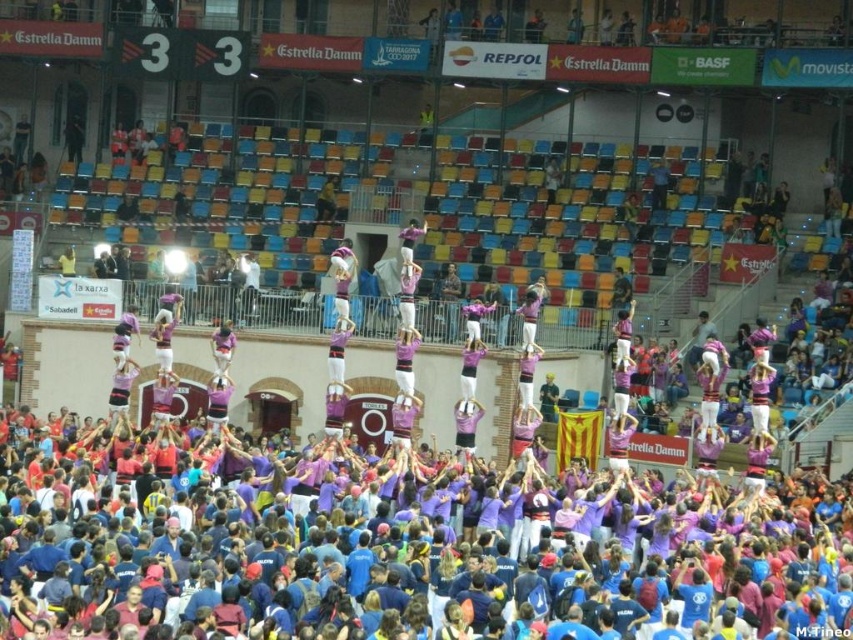
Question: Which of the following is the closest to the observer?

Choices:
 (A) (724, 550)
 (B) (408, 401)
 (C) (213, 356)
 (D) (345, 390)

Answer: (A)

Question: Which point is farther from the camera taking this photo?

Choices:
 (A) (410, 324)
 (B) (648, 636)
 (C) (225, 352)
 (D) (344, 342)

Answer: (C)

Question: Is purple fabric at center to the right of purple fabric person at center from the viewer's perspective?

Choices:
 (A) no
 (B) yes

Answer: (B)

Question: Does purple cotton crowd at center appear on the left side of purple fabric human at center?

Choices:
 (A) yes
 (B) no

Answer: (A)

Question: Is purple cotton crowd at center smaller than purple fabric person at center?

Choices:
 (A) no
 (B) yes

Answer: (A)

Question: Considering the real-world distances, which object is closest to the pink fabric person at center?

Choices:
 (A) purple cotton crowd at center
 (B) purple fabric human at center

Answer: (B)